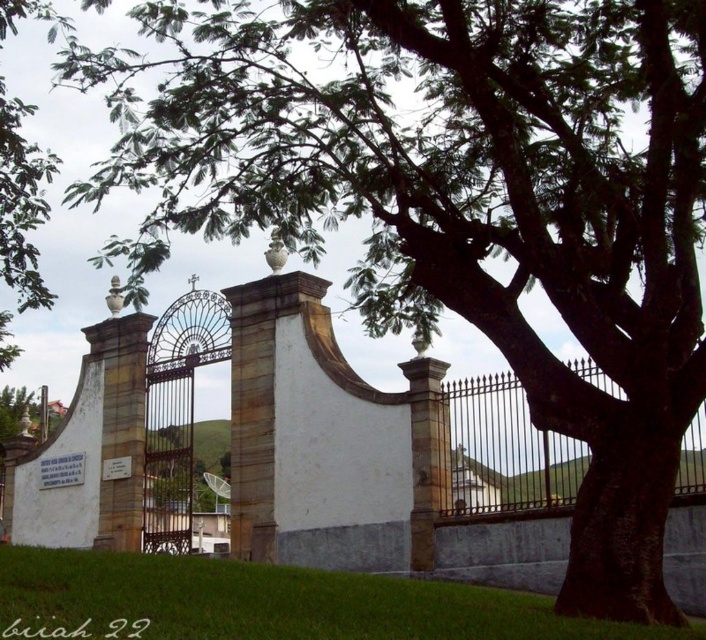
Between green grass at lower left and iron/golden gate at center, which one appears on the left side from the viewer's perspective?

From the viewer's perspective, green grass at lower left appears more on the left side.

Image resolution: width=706 pixels, height=640 pixels. Describe the element at coordinates (268, 602) in the screenshot. I see `green grass at lower left` at that location.

Image resolution: width=706 pixels, height=640 pixels. Find the location of `green grass at lower left`. green grass at lower left is located at coordinates (268, 602).